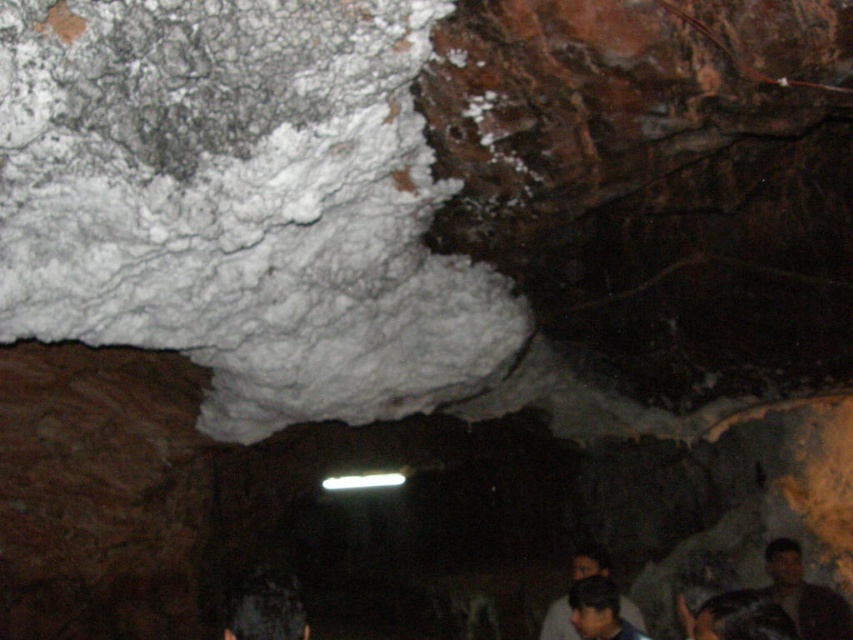
Looking at this image, can you confirm if dark brown leather jacket at lower right is positioned below dark brown hair at lower center?

Yes.

Measure the distance from dark brown leather jacket at lower right to dark brown hair at lower center.

dark brown leather jacket at lower right and dark brown hair at lower center are 3.41 meters apart from each other.

Locate an element on the screen. This screenshot has height=640, width=853. dark brown leather jacket at lower right is located at coordinates (804, 595).

Is point (831, 611) farther from viewer compared to point (619, 608)?

Yes, it is.

Which is above, dark brown leather jacket at lower right or dark hair at lower right?

dark brown leather jacket at lower right

Is point (807, 636) positioned in front of point (584, 570)?

Yes, it is in front of point (584, 570).

The image size is (853, 640). I want to click on dark brown leather jacket at lower right, so 804,595.

Based on the photo, can you confirm if white crumbly rock at upper left is positioned below dark hair at lower right?

Actually, white crumbly rock at upper left is above dark hair at lower right.

Between white crumbly rock at upper left and dark hair at lower right, which one appears on the right side from the viewer's perspective?

Positioned to the right is dark hair at lower right.

Does point (405, 120) come behind point (560, 625)?

No, it is not.

Identify the location of white crumbly rock at upper left. (241, 204).